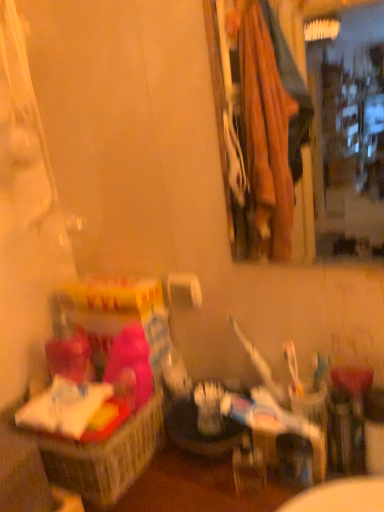
Question: From the image's perspective, would you say wooden frame mirror at upper right is shown under pink fabric basket at left?

Choices:
 (A) yes
 (B) no

Answer: (B)

Question: Does wooden frame mirror at upper right turn towards pink fabric basket at left?

Choices:
 (A) no
 (B) yes

Answer: (A)

Question: Considering the relative positions of wooden frame mirror at upper right and pink fabric basket at left in the image provided, is wooden frame mirror at upper right to the left of pink fabric basket at left from the viewer's perspective?

Choices:
 (A) yes
 (B) no

Answer: (B)

Question: From a real-world perspective, is wooden frame mirror at upper right below pink fabric basket at left?

Choices:
 (A) yes
 (B) no

Answer: (B)

Question: Considering the relative positions of wooden frame mirror at upper right and pink fabric basket at left in the image provided, is wooden frame mirror at upper right behind pink fabric basket at left?

Choices:
 (A) no
 (B) yes

Answer: (A)

Question: Considering the positions of white matte toilet paper at center and pink fabric basket at left in the image, is white matte toilet paper at center bigger or smaller than pink fabric basket at left?

Choices:
 (A) big
 (B) small

Answer: (B)

Question: Based on their positions, is white matte toilet paper at center located to the left or right of pink fabric basket at left?

Choices:
 (A) left
 (B) right

Answer: (B)

Question: Considering the positions of white matte toilet paper at center and pink fabric basket at left in the image, is white matte toilet paper at center taller or shorter than pink fabric basket at left?

Choices:
 (A) short
 (B) tall

Answer: (A)

Question: Is point (170, 287) closer or farther from the camera than point (94, 448)?

Choices:
 (A) closer
 (B) farther

Answer: (B)

Question: From the image's perspective, is wooden frame mirror at upper right located above or below white matte toilet paper at center?

Choices:
 (A) below
 (B) above

Answer: (B)

Question: Would you say wooden frame mirror at upper right is to the left or to the right of white matte toilet paper at center in the picture?

Choices:
 (A) left
 (B) right

Answer: (B)

Question: Which is correct: wooden frame mirror at upper right is inside white matte toilet paper at center, or outside of it?

Choices:
 (A) inside
 (B) outside

Answer: (B)

Question: Is wooden frame mirror at upper right in front of or behind white matte toilet paper at center in the image?

Choices:
 (A) behind
 (B) front

Answer: (B)

Question: Is pink fabric basket at left bigger or smaller than white matte toilet paper at center?

Choices:
 (A) big
 (B) small

Answer: (A)

Question: From the image's perspective, is pink fabric basket at left positioned above or below white matte toilet paper at center?

Choices:
 (A) above
 (B) below

Answer: (B)